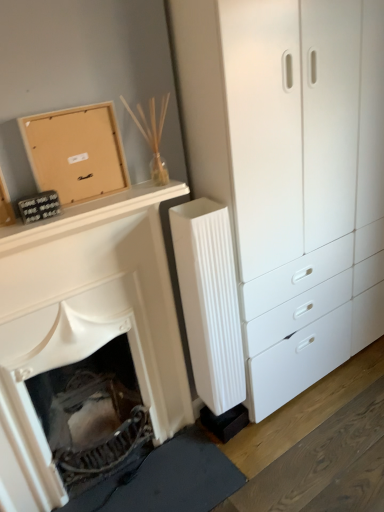
The height and width of the screenshot is (512, 384). Identify the location of vacant point to the right of matte brown cardboard at upper left. (122, 192).